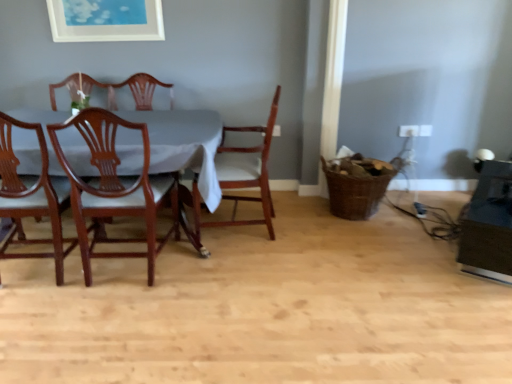
Question: Is mahogany wood chair at left, which ranks as the third chair in right-to-left order, positioned far away from white matte picture frame at upper center?

Choices:
 (A) no
 (B) yes

Answer: (B)

Question: Does mahogany wood chair at left, placed as the first chair when sorted from left to right, lie behind white matte picture frame at upper center?

Choices:
 (A) yes
 (B) no

Answer: (B)

Question: From the image's perspective, is mahogany wood chair at left, which ranks as the third chair in right-to-left order, located beneath white matte picture frame at upper center?

Choices:
 (A) yes
 (B) no

Answer: (A)

Question: Can you confirm if mahogany wood chair at left, placed as the first chair when sorted from left to right, is shorter than white matte picture frame at upper center?

Choices:
 (A) no
 (B) yes

Answer: (A)

Question: Can you confirm if mahogany wood chair at left, placed as the first chair when sorted from left to right, is bigger than white matte picture frame at upper center?

Choices:
 (A) no
 (B) yes

Answer: (B)

Question: From the image's perspective, is wooden chair at center, which is the 3th chair from left to right, positioned above or below mahogany wood chair at center, marked as the second chair in a right-to-left arrangement?

Choices:
 (A) above
 (B) below

Answer: (A)

Question: Considering the relative positions of wooden chair at center, which ranks as the first chair in right-to-left order, and mahogany wood chair at center, marked as the second chair in a right-to-left arrangement, in the image provided, is wooden chair at center, which ranks as the first chair in right-to-left order, to the left or to the right of mahogany wood chair at center, marked as the second chair in a right-to-left arrangement,?

Choices:
 (A) left
 (B) right

Answer: (B)

Question: Is wooden chair at center, which ranks as the first chair in right-to-left order, in front of or behind mahogany wood chair at center, which ranks as the 2th chair in left-to-right order, in the image?

Choices:
 (A) behind
 (B) front

Answer: (A)

Question: In terms of height, does wooden chair at center, which ranks as the first chair in right-to-left order, look taller or shorter compared to mahogany wood chair at center, marked as the second chair in a right-to-left arrangement?

Choices:
 (A) short
 (B) tall

Answer: (A)

Question: From a real-world perspective, is brown woven basket at lower right positioned above or below white matte picture frame at upper center?

Choices:
 (A) above
 (B) below

Answer: (B)

Question: From the image's perspective, is brown woven basket at lower right located above or below white matte picture frame at upper center?

Choices:
 (A) below
 (B) above

Answer: (A)

Question: Considering the positions of brown woven basket at lower right and white matte picture frame at upper center in the image, is brown woven basket at lower right bigger or smaller than white matte picture frame at upper center?

Choices:
 (A) small
 (B) big

Answer: (B)

Question: Considering their positions, is brown woven basket at lower right located in front of or behind white matte picture frame at upper center?

Choices:
 (A) front
 (B) behind

Answer: (A)

Question: From the image's perspective, is mahogany wood chair at center, which ranks as the 2th chair in left-to-right order, located above or below wooden chair at center, which ranks as the first chair in right-to-left order?

Choices:
 (A) below
 (B) above

Answer: (A)

Question: Visually, is mahogany wood chair at center, marked as the second chair in a right-to-left arrangement, positioned to the left or to the right of wooden chair at center, which is the 3th chair from left to right?

Choices:
 (A) left
 (B) right

Answer: (A)